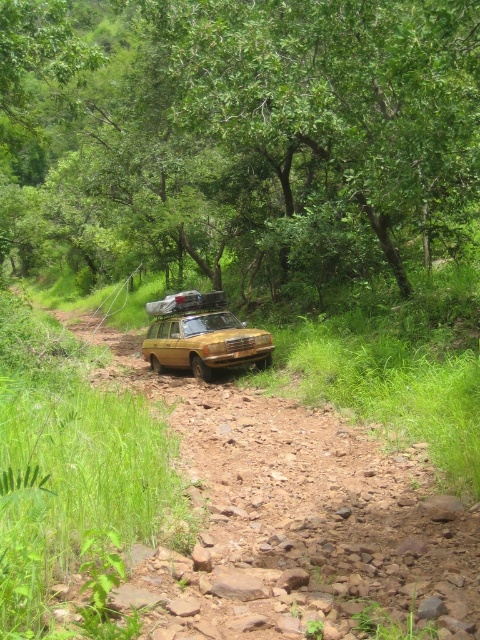
Who is positioned more to the right, green leafy tree at center or matte yellow jeep at center?

Positioned to the right is matte yellow jeep at center.

Between green leafy tree at center and matte yellow jeep at center, which one appears on the left side from the viewer's perspective?

green leafy tree at center

The height and width of the screenshot is (640, 480). What are the coordinates of `green leafy tree at center` in the screenshot? It's located at (243, 132).

Find the location of a particular element. green leafy tree at center is located at coordinates (243, 132).

From the picture: Who is more forward, (106, 125) or (322, 440)?

Point (322, 440) is in front.

Between green leafy tree at center and brown rocky dirt track at center, which one is positioned lower?

brown rocky dirt track at center

Who is more distant from viewer, (108, 198) or (162, 381)?

Positioned behind is point (108, 198).

Find the location of a particular element. This screenshot has height=640, width=480. green leafy tree at center is located at coordinates (243, 132).

Can you confirm if brown rocky dirt track at center is thinner than matte yellow jeep at center?

No, brown rocky dirt track at center is not thinner than matte yellow jeep at center.

Which is behind, point (181, 612) or point (204, 308)?

The point (204, 308) is behind.

The width and height of the screenshot is (480, 640). Find the location of `brown rocky dirt track at center`. brown rocky dirt track at center is located at coordinates (295, 516).